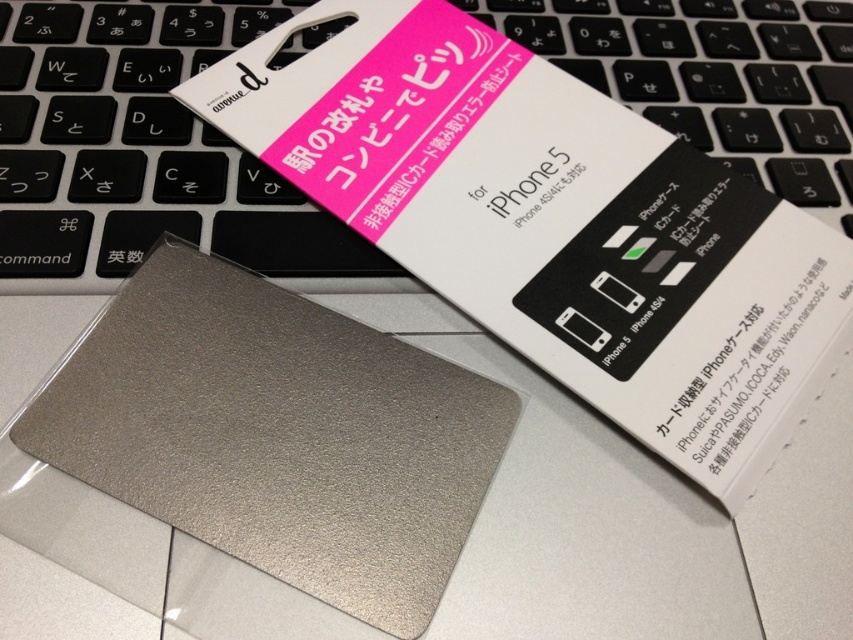
Does metallic silver card at center have a lesser width compared to satin silver keyboard at center?

In fact, metallic silver card at center might be wider than satin silver keyboard at center.

Which is more to the left, metallic silver card at center or satin silver keyboard at center?

Positioned to the left is satin silver keyboard at center.

Between point (495, 332) and point (119, 211), which one is positioned behind?

Point (119, 211)

Identify the location of metallic silver card at center. The width and height of the screenshot is (853, 640). (555, 224).